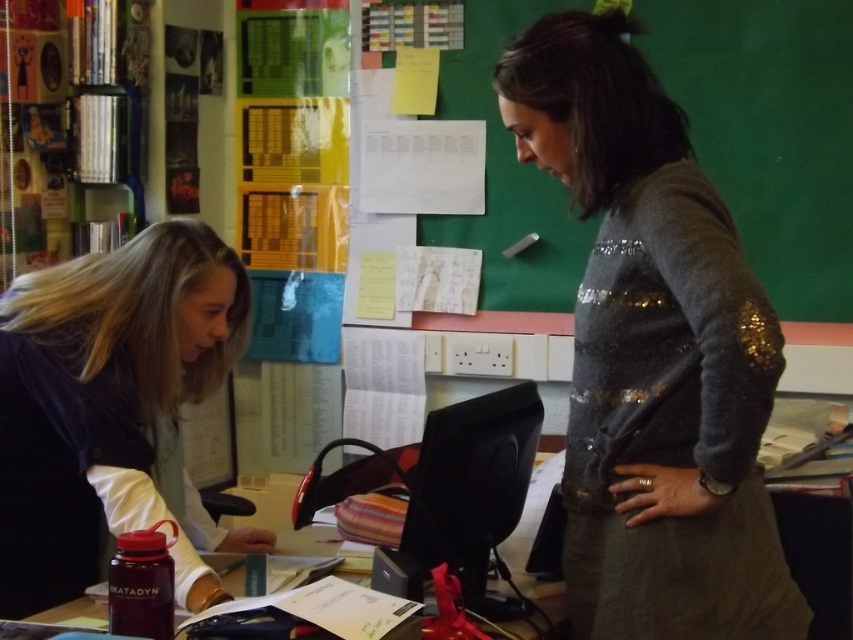
Question: Is black glossy monitor at center to the right of translucent plastic water bottle at lower left from the viewer's perspective?

Choices:
 (A) no
 (B) yes

Answer: (B)

Question: Which point is closer to the camera taking this photo?

Choices:
 (A) (70, 605)
 (B) (512, 416)

Answer: (B)

Question: Which of these objects is positioned closest to the translucent plastic water bottle at lower left?

Choices:
 (A) matte black jacket at left
 (B) green matte bulletin board at upper center
 (C) sparkly gray sweater at right

Answer: (A)

Question: Based on their relative distances, which object is farther from the black glossy monitor at center?

Choices:
 (A) green matte bulletin board at upper center
 (B) matte black jacket at left
 (C) translucent plastic water bottle at lower left

Answer: (A)

Question: From the image, what is the correct spatial relationship of matte black jacket at left in relation to black glossy monitor at center?

Choices:
 (A) right
 (B) left

Answer: (B)

Question: Is sparkly gray sweater at right smaller than matte black jacket at left?

Choices:
 (A) no
 (B) yes

Answer: (A)